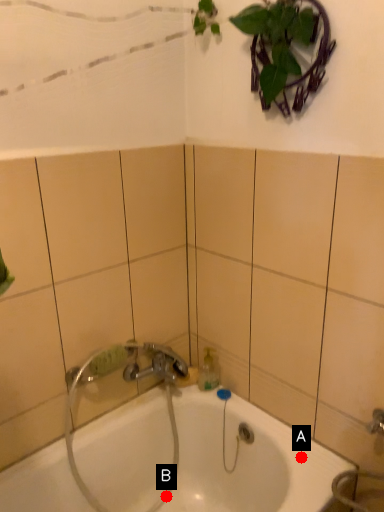
Question: Two points are circled on the image, labeled by A and B beside each circle. Among these points, which one is farthest from the camera?

Choices:
 (A) A is further
 (B) B is further

Answer: (B)